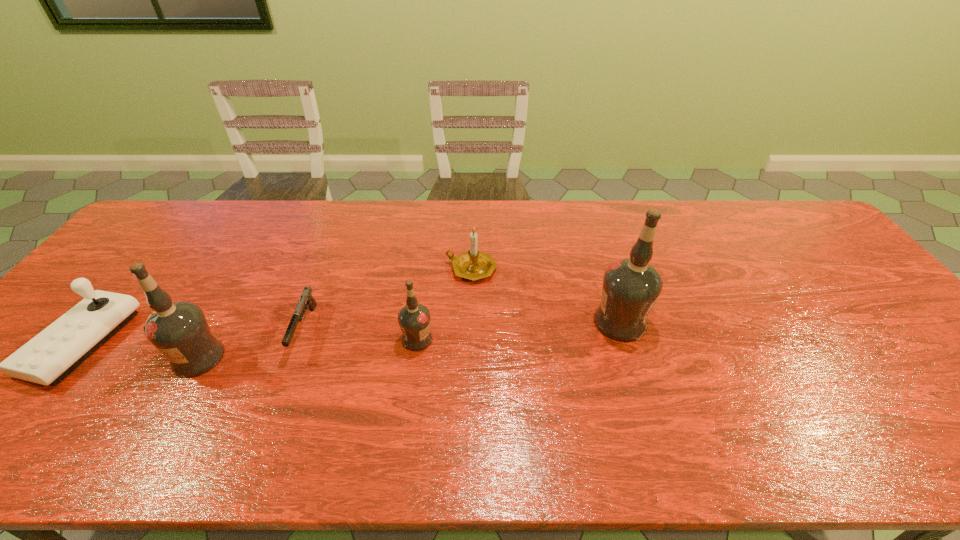
Identify which vodka is the nearest to the rightmost object. Please provide its 2D coordinates. Your answer should be formatted as a tuple, i.e. [(x, y)], where the tuple contains the x and y coordinates of a point satisfying the conditions above.

[(414, 318)]